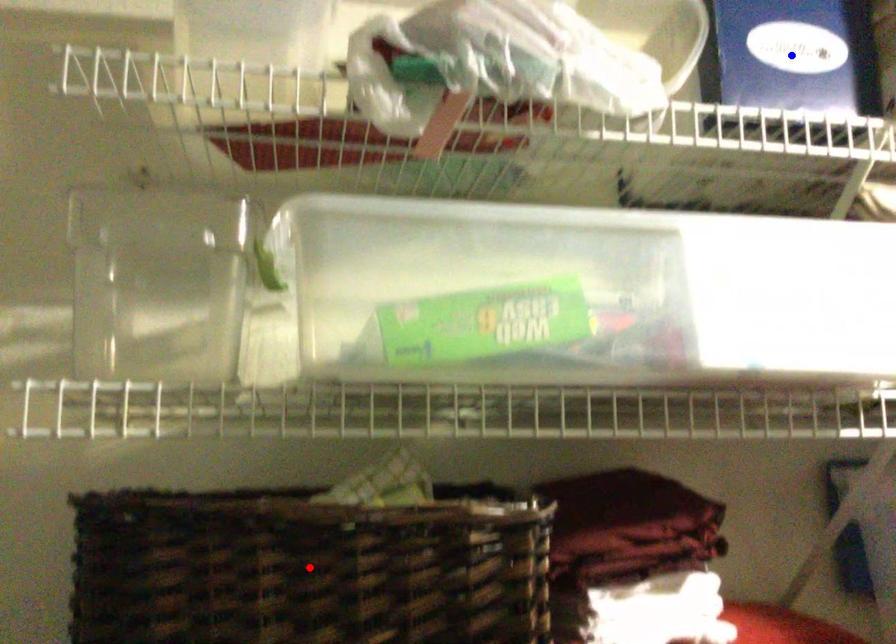
Question: Two points are marked on the image. Which point is closer to the camera?

Choices:
 (A) Blue point is closer.
 (B) Red point is closer.

Answer: (B)